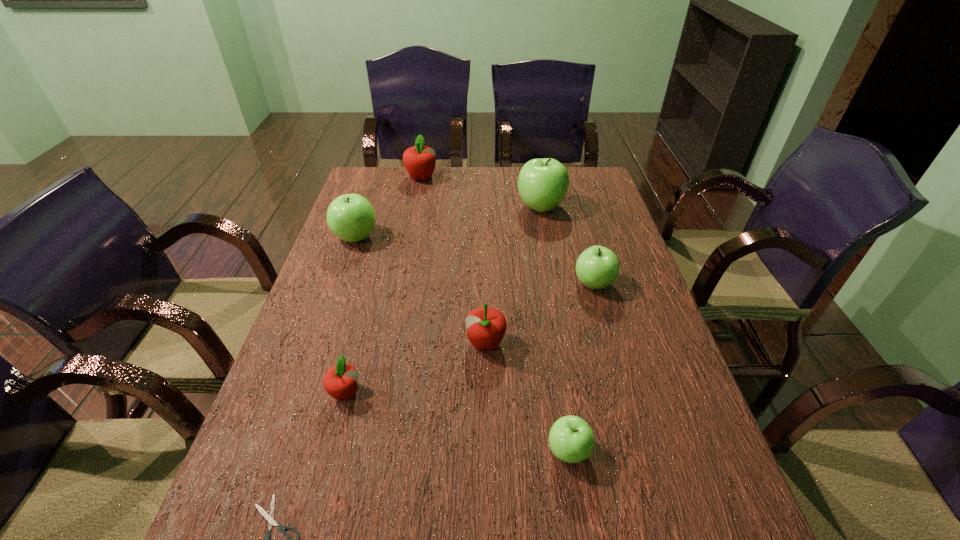
This screenshot has width=960, height=540. I want to click on free space between the farthest apple and the fifth farthest apple, so click(x=453, y=260).

The width and height of the screenshot is (960, 540). In order to click on free space between the second biggest green apple and the sixth nearest apple in this screenshot , I will do `click(448, 222)`.

You are a GUI agent. You are given a task and a screenshot of the screen. Output one action in this format:
    pyautogui.click(x=<x>, y=<y>)
    Task: Click on the blank region between the fourth nearest apple and the second farthest green apple
    
    Given the screenshot: What is the action you would take?
    pyautogui.click(x=475, y=260)

Identify the location of unoccupied position between the rightmost red apple and the third farthest object. The width and height of the screenshot is (960, 540). (420, 290).

Choose which object is the third nearest neighbor to the farthest apple. Please provide its 2D coordinates. Your answer should be formatted as a tuple, i.e. [(x, y)], where the tuple contains the x and y coordinates of a point satisfying the conditions above.

[(597, 267)]

Find the location of a particular element. object that stands as the fourth closest to the farthest apple is located at coordinates (486, 326).

The width and height of the screenshot is (960, 540). In order to click on apple that is the sixth closest one to the third farthest green apple in this screenshot , I will do tap(419, 160).

Where is `apple that stands as the second closest to the third farthest green apple`? The height and width of the screenshot is (540, 960). apple that stands as the second closest to the third farthest green apple is located at coordinates (543, 183).

Choose which green apple is the nearest neighbor to the biggest green apple. Please provide its 2D coordinates. Your answer should be formatted as a tuple, i.e. [(x, y)], where the tuple contains the x and y coordinates of a point satisfying the conditions above.

[(597, 267)]

Identify which green apple is the second closest to the third nearest apple. Please provide its 2D coordinates. Your answer should be formatted as a tuple, i.e. [(x, y)], where the tuple contains the x and y coordinates of a point satisfying the conditions above.

[(597, 267)]